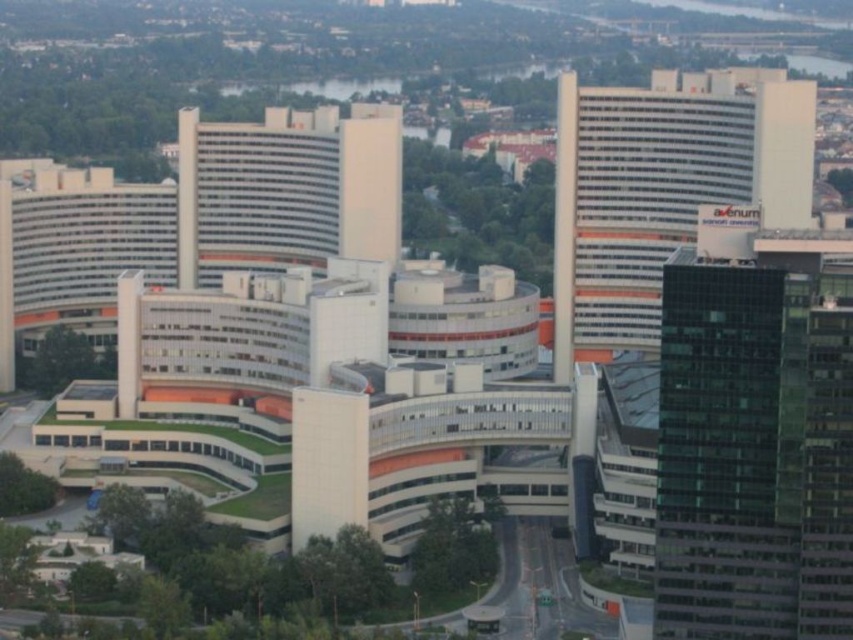
You are standing at point (756, 442) in the urban landscape. What type of building are you currently located in?

You are located in the green glass skyscraper at right.